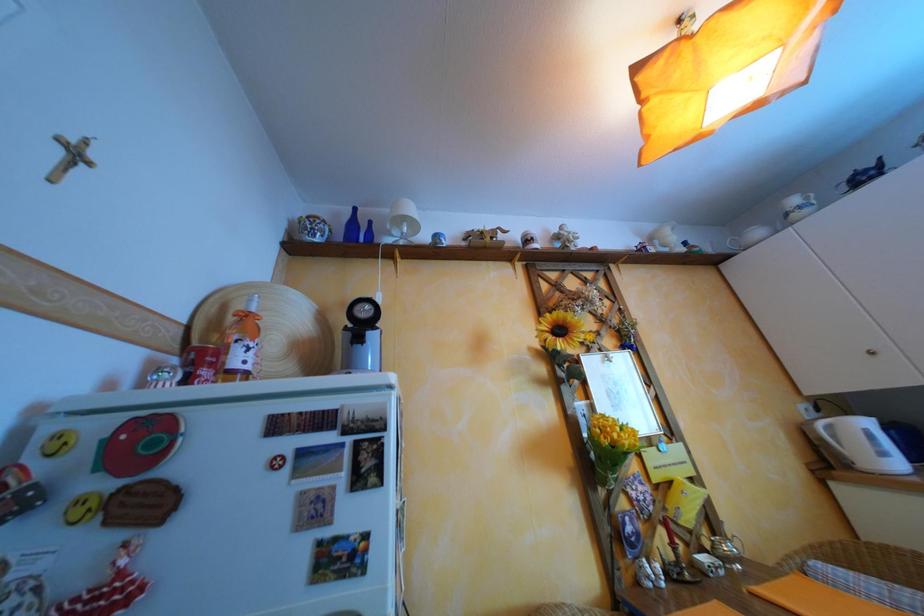
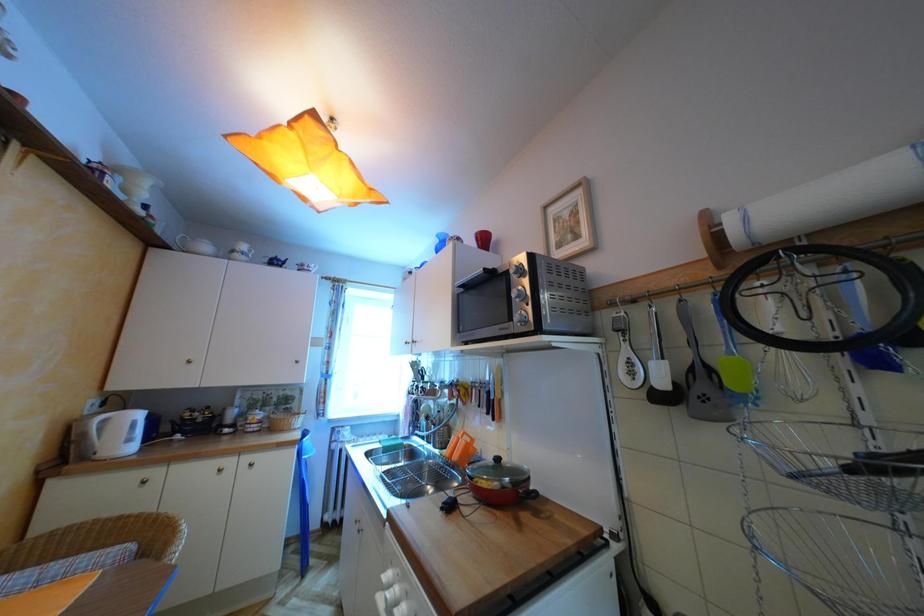
The first image is from the beginning of the video and the second image is from the end. How did the camera likely rotate when shooting the video?

The camera's rotation is toward right-up.